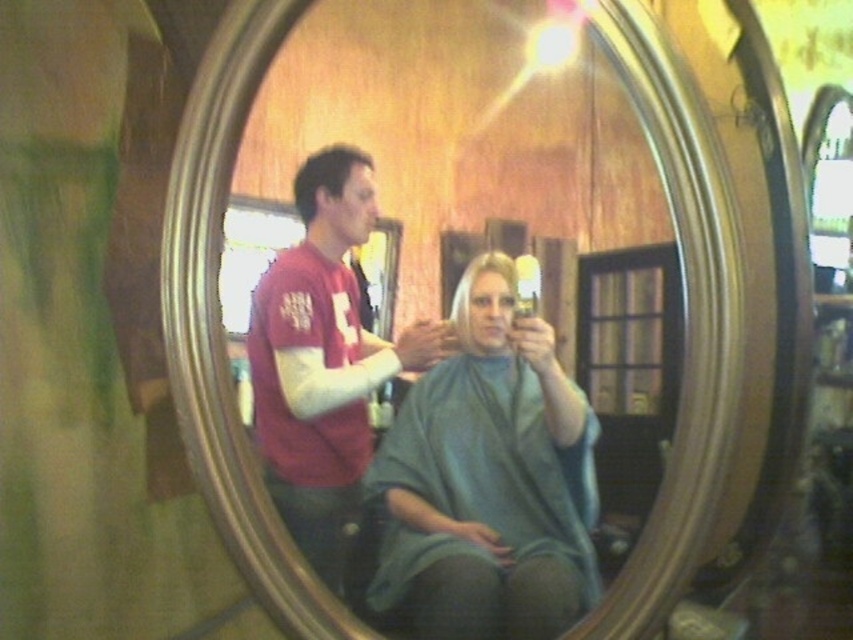
Question: Is silver metallic mirror at center positioned in front of blonde hair at center?

Choices:
 (A) yes
 (B) no

Answer: (B)

Question: Can you confirm if silver metallic mirror at center is positioned below dark brown hair at center?

Choices:
 (A) no
 (B) yes

Answer: (B)

Question: Does silver metallic mirror at center appear under green fabric cape at center?

Choices:
 (A) no
 (B) yes

Answer: (A)

Question: Which point is closer to the camera?

Choices:
 (A) (469, 333)
 (B) (592, 452)
 (C) (328, 186)

Answer: (B)

Question: Which point is farther to the camera?

Choices:
 (A) matte red shirt at center
 (B) silver metallic mirror at center

Answer: (B)

Question: Which object is the closest to the dark brown hair at center?

Choices:
 (A) silver metallic mirror at center
 (B) blonde hair at center
 (C) matte red shirt at center
 (D) green fabric cape at center

Answer: (C)